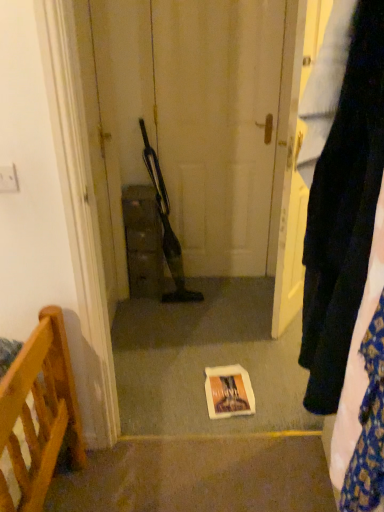
At what (x,y) coordinates should I click in order to perform the action: click on free space in front of white paper bag at center. Please return your answer as a coordinate pair (x, y). The image size is (384, 512). Looking at the image, I should click on (220, 424).